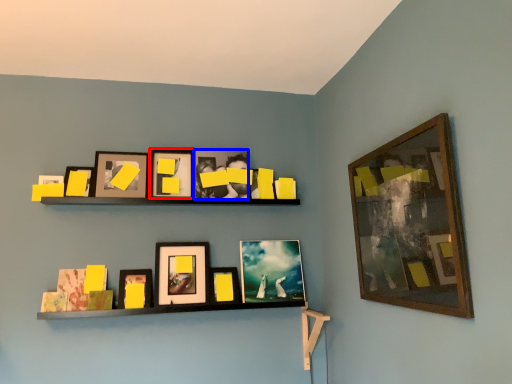
Question: Among these objects, which one is nearest to the camera, picture frame (highlighted by a red box) or picture frame (highlighted by a blue box)?

Choices:
 (A) picture frame
 (B) picture frame

Answer: (A)